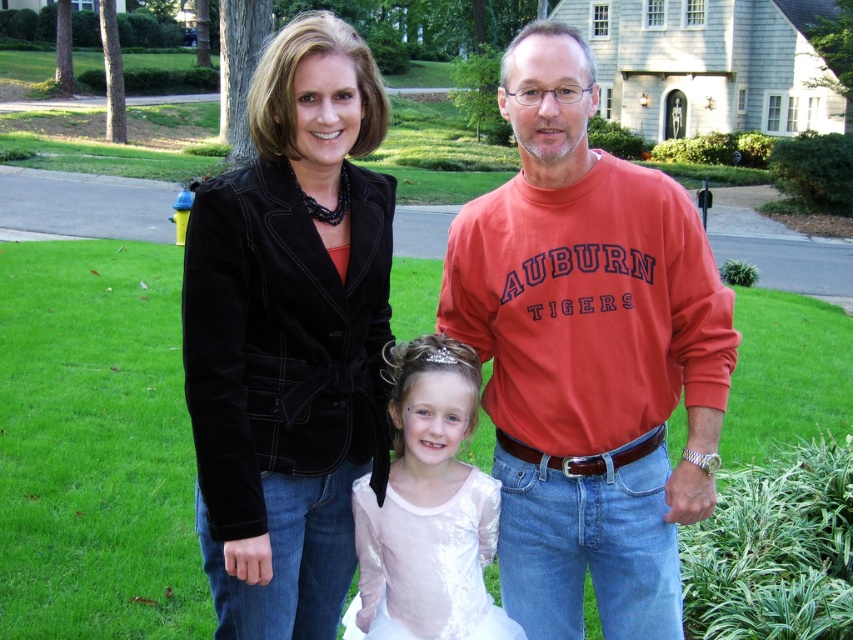
What is located at the coordinates point (587, 355)?

The orange cotton sweatshirt at center is located at point (587, 355).

You are a photographer trying to capture a family portrait. You notice two clothing items in the scene that might be distracting due to their bright colors. The orange cotton sweatshirt at center and the black velvet jacket at center. Which clothing item is positioned to the right side of the other?

The orange cotton sweatshirt at center is to the right of the black velvet jacket at center.

You are a tailor measuring clothing for alterations. You have an orange cotton sweatshirt at center and a black velvet jacket at center. Which clothing item requires a wider alteration measurement?

The orange cotton sweatshirt at center requires a wider alteration measurement since its width surpasses that of the black velvet jacket at center.